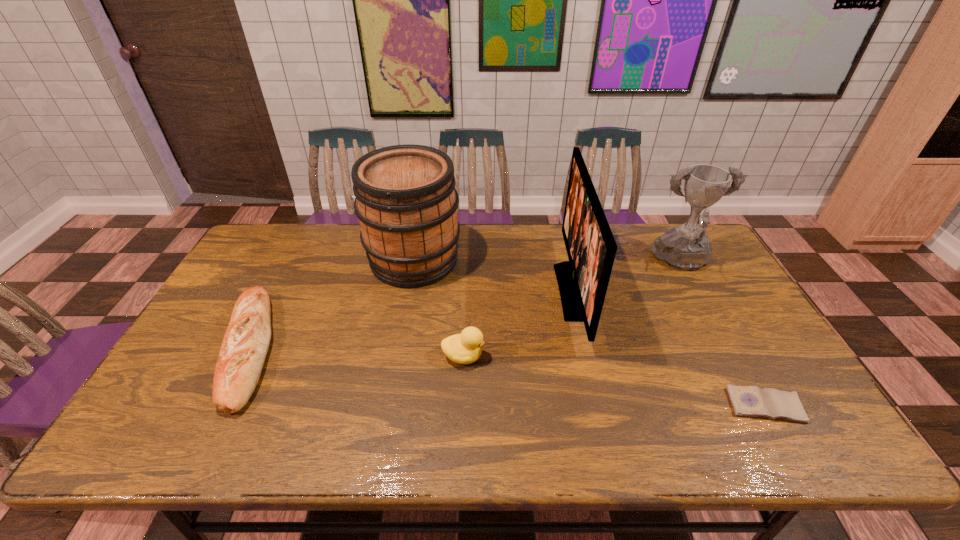
Find the location of `award that is positioned at the right edge`. award that is positioned at the right edge is located at coordinates (686, 247).

Where is `diary that is at the right edge`? diary that is at the right edge is located at coordinates (751, 401).

Identify the location of object at the far right corner. Image resolution: width=960 pixels, height=540 pixels. (686, 247).

Where is `object positioned at the near right corner`? The height and width of the screenshot is (540, 960). object positioned at the near right corner is located at coordinates (751, 401).

Find the location of a particular element. free space at the far edge is located at coordinates (527, 235).

In the image, there is a desktop. What are the coordinates of `vacant space at the near edge` in the screenshot? It's located at (603, 435).

I want to click on free region at the left edge, so click(246, 270).

The height and width of the screenshot is (540, 960). I want to click on vacant space at the near right corner of the desktop, so click(x=825, y=443).

Where is `blank region between the third object from right to left and the award`? Image resolution: width=960 pixels, height=540 pixels. blank region between the third object from right to left and the award is located at coordinates (628, 277).

You are a GUI agent. You are given a task and a screenshot of the screen. Output one action in this format:
    pyautogui.click(x=<x>, y=<y>)
    Task: Click on the unoccupied area between the cider and the award
    This screenshot has width=960, height=540.
    Given the screenshot: What is the action you would take?
    pyautogui.click(x=548, y=261)